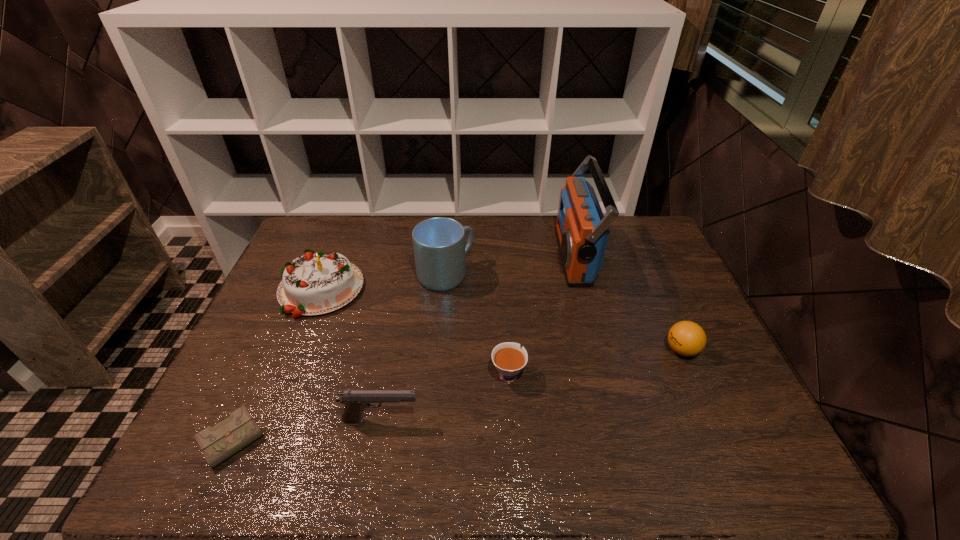
The width and height of the screenshot is (960, 540). Find the location of `unoccupied position between the radio receiver and the second tallest object`. unoccupied position between the radio receiver and the second tallest object is located at coordinates (510, 266).

You are a GUI agent. You are given a task and a screenshot of the screen. Output one action in this format:
    pyautogui.click(x=<x>, y=<y>)
    Task: Click on the free space between the cake and the diary
    
    Given the screenshot: What is the action you would take?
    pyautogui.click(x=277, y=364)

Locate an element on the screen. The height and width of the screenshot is (540, 960). vacant area between the pistol and the cake is located at coordinates (350, 355).

You are a GUI agent. You are given a task and a screenshot of the screen. Output one action in this format:
    pyautogui.click(x=<x>, y=<y>)
    Task: Click on the vacant area that lies between the rightmost object and the fifth object from left to right
    
    Given the screenshot: What is the action you would take?
    pyautogui.click(x=595, y=362)

Locate an element on the screen. Image resolution: width=960 pixels, height=540 pixels. the second closest object to the pistol is located at coordinates (509, 359).

Locate an element on the screen. This screenshot has width=960, height=540. the third closest object to the third tallest object is located at coordinates (355, 401).

Where is `vacant space that satisfies the following two spatial constraints: 1. on the back side of the cake; 2. on the left side of the shortest object`? This screenshot has width=960, height=540. vacant space that satisfies the following two spatial constraints: 1. on the back side of the cake; 2. on the left side of the shortest object is located at coordinates (302, 289).